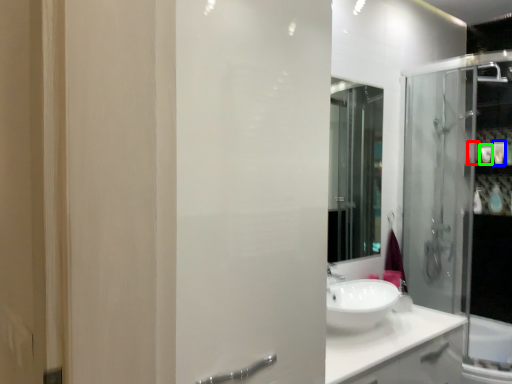
Question: Which is farther away from toiletry (highlighted by a red box)? toiletry (highlighted by a blue box) or toiletry (highlighted by a green box)?

Choices:
 (A) toiletry
 (B) toiletry

Answer: (A)